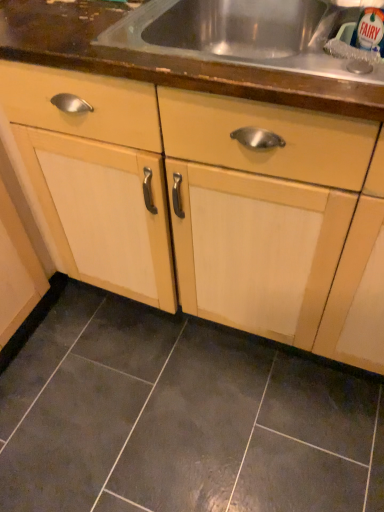
Describe the element at coordinates (225, 188) in the screenshot. This screenshot has height=512, width=384. I see `light wood cabinet at center` at that location.

At what (x,y) coordinates should I click in order to perform the action: click on light wood cabinet at center. Please return your answer as a coordinate pair (x, y). The height and width of the screenshot is (512, 384). Looking at the image, I should click on (225, 188).

Locate an element on the screen. The height and width of the screenshot is (512, 384). wooden countertop at upper center is located at coordinates (201, 47).

This screenshot has width=384, height=512. Describe the element at coordinates (201, 47) in the screenshot. I see `wooden countertop at upper center` at that location.

The width and height of the screenshot is (384, 512). What do you see at coordinates (180, 419) in the screenshot?
I see `dark gray ceramic tile at lower center` at bounding box center [180, 419].

You are a GUI agent. You are given a task and a screenshot of the screen. Output one action in this format:
    pyautogui.click(x=<x>, y=<y>)
    Task: Click on the light wood cabinet at center
    The width and height of the screenshot is (384, 512).
    Given the screenshot: What is the action you would take?
    pyautogui.click(x=225, y=188)

Looking at their sizes, would you say dark gray ceramic tile at lower center is wider or thinner than wooden countertop at upper center?

In the image, dark gray ceramic tile at lower center appears to be wider than wooden countertop at upper center.

Measure the distance from dark gray ceramic tile at lower center to wooden countertop at upper center.

89.22 centimeters.

Between dark gray ceramic tile at lower center and wooden countertop at upper center, which one has larger size?

wooden countertop at upper center.

From a real-world perspective, between dark gray ceramic tile at lower center and wooden countertop at upper center, who is vertically higher?

From a 3D spatial view, wooden countertop at upper center is above.

Between light wood cabinet at center and wooden countertop at upper center, which one has larger width?

Wider between the two is light wood cabinet at center.

Consider the image. In terms of size, does light wood cabinet at center appear bigger or smaller than wooden countertop at upper center?

Clearly, light wood cabinet at center is larger in size than wooden countertop at upper center.

Would you say light wood cabinet at center is a long distance from wooden countertop at upper center?

No, light wood cabinet at center is in close proximity to wooden countertop at upper center.

Considering the sizes of objects light wood cabinet at center and wooden countertop at upper center in the image provided, who is shorter, light wood cabinet at center or wooden countertop at upper center?

Standing shorter between the two is wooden countertop at upper center.

Based on the photo, is wooden countertop at upper center at the right side of dark gray ceramic tile at lower center?

Correct, you'll find wooden countertop at upper center to the right of dark gray ceramic tile at lower center.

Considering the relative sizes of wooden countertop at upper center and dark gray ceramic tile at lower center in the image provided, is wooden countertop at upper center thinner than dark gray ceramic tile at lower center?

Correct, the width of wooden countertop at upper center is less than that of dark gray ceramic tile at lower center.

Considering the relative sizes of wooden countertop at upper center and dark gray ceramic tile at lower center in the image provided, is wooden countertop at upper center shorter than dark gray ceramic tile at lower center?

No, wooden countertop at upper center is not shorter than dark gray ceramic tile at lower center.

Can you tell me how much light wood cabinet at center and dark gray ceramic tile at lower center differ in facing direction?

The angular difference between light wood cabinet at center and dark gray ceramic tile at lower center is 89.2 degrees.

From a real-world perspective, is light wood cabinet at center positioned under dark gray ceramic tile at lower center based on gravity?

Incorrect, from a real-world perspective, light wood cabinet at center is higher than dark gray ceramic tile at lower center.

Which is in front, point (216, 202) or point (361, 418)?

The point (216, 202) is closer to the camera.

From their relative heights in the image, would you say light wood cabinet at center is taller or shorter than dark gray ceramic tile at lower center?

light wood cabinet at center is taller than dark gray ceramic tile at lower center.

Is wooden countertop at upper center in front of light wood cabinet at center?

No, wooden countertop at upper center is further to the viewer.

Identify the location of countertop behind the light wood cabinet at center. (201, 47).

Considering the positions of objects wooden countertop at upper center and light wood cabinet at center in the image provided, who is more to the left, wooden countertop at upper center or light wood cabinet at center?

From the viewer's perspective, light wood cabinet at center appears more on the left side.

Is dark gray ceramic tile at lower center not inside light wood cabinet at center?

That's correct, dark gray ceramic tile at lower center is outside of light wood cabinet at center.

Based on the photo, measure the distance from dark gray ceramic tile at lower center to light wood cabinet at center.

dark gray ceramic tile at lower center and light wood cabinet at center are 17.56 inches apart from each other.

Considering the sizes of objects dark gray ceramic tile at lower center and light wood cabinet at center in the image provided, who is thinner, dark gray ceramic tile at lower center or light wood cabinet at center?

Thinner between the two is light wood cabinet at center.

What are the coordinates of `countertop above the dark gray ceramic tile at lower center (from a real-world perspective)` in the screenshot? It's located at (201, 47).

Where is `countertop behind the light wood cabinet at center`? This screenshot has width=384, height=512. countertop behind the light wood cabinet at center is located at coordinates (201, 47).

From the picture: Looking at the image, which one is located further to wooden countertop at upper center, dark gray ceramic tile at lower center or light wood cabinet at center?

dark gray ceramic tile at lower center.

When comparing their distances from dark gray ceramic tile at lower center, does light wood cabinet at center or wooden countertop at upper center seem further?

wooden countertop at upper center is positioned further to the anchor dark gray ceramic tile at lower center.

When comparing their distances from light wood cabinet at center, does wooden countertop at upper center or dark gray ceramic tile at lower center seem closer?

Among the two, wooden countertop at upper center is located nearer to light wood cabinet at center.

Considering their positions, is wooden countertop at upper center positioned further to dark gray ceramic tile at lower center than light wood cabinet at center?

wooden countertop at upper center is positioned further to the anchor dark gray ceramic tile at lower center.

Considering their positions, is light wood cabinet at center positioned further to wooden countertop at upper center than dark gray ceramic tile at lower center?

dark gray ceramic tile at lower center lies further to wooden countertop at upper center than the other object.

When comparing their distances from light wood cabinet at center, does dark gray ceramic tile at lower center or wooden countertop at upper center seem further?

Among the two, dark gray ceramic tile at lower center is located further to light wood cabinet at center.

Identify the location of cabinetry that lies between wooden countertop at upper center and dark gray ceramic tile at lower center from top to bottom. pyautogui.click(x=225, y=188).